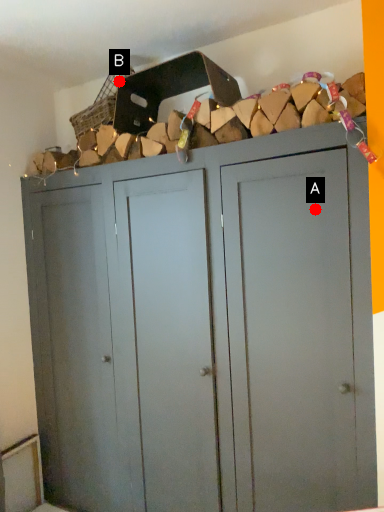
Question: Two points are circled on the image, labeled by A and B beside each circle. Which point appears closest to the camera in this image?

Choices:
 (A) A is closer
 (B) B is closer

Answer: (A)